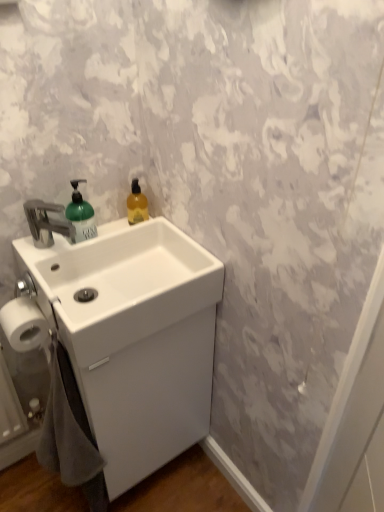
The image size is (384, 512). Identify the location of vacant area that is situated to the right of green matte soap dispenser at left. (137, 232).